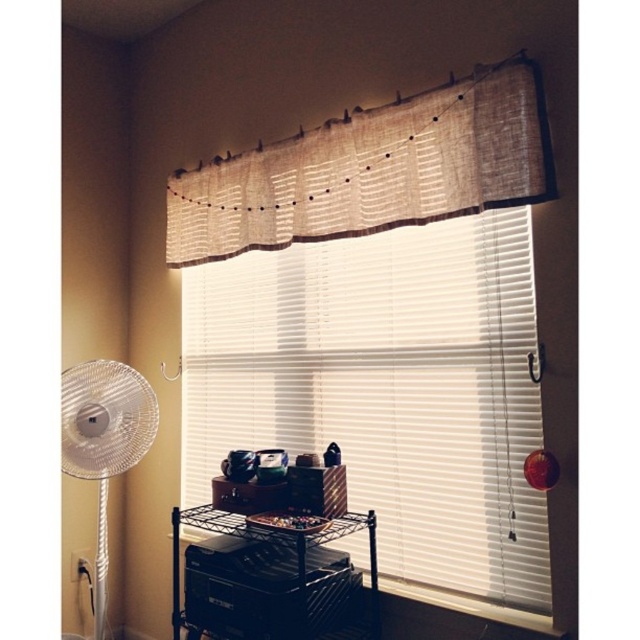
Which is above, white blinds at center or burlap curtain at upper center?

burlap curtain at upper center is higher up.

Is white blinds at center wider than burlap curtain at upper center?

No.

Between point (216, 298) and point (356, 220), which one is positioned behind?

The point (216, 298) is more distant.

Find the location of a particular element. The image size is (640, 640). white blinds at center is located at coordinates (387, 388).

Between burlap curtain at upper center and black metal cart at center, which one is positioned lower?

black metal cart at center is below.

Who is more forward, [525,90] or [241,589]?

Point [525,90] is more forward.

The width and height of the screenshot is (640, 640). I want to click on burlap curtain at upper center, so click(372, 170).

This screenshot has height=640, width=640. What do you see at coordinates (273, 580) in the screenshot? I see `black metal cart at center` at bounding box center [273, 580].

Is black metal cart at center below transparent plastic fan at left?

Correct, black metal cart at center is located below transparent plastic fan at left.

Between point (256, 564) and point (122, 369), which one is positioned in front?

Point (256, 564) is more forward.

At what (x,y) coordinates should I click in order to perform the action: click on black metal cart at center. Please return your answer as a coordinate pair (x, y). The height and width of the screenshot is (640, 640). Looking at the image, I should click on (273, 580).